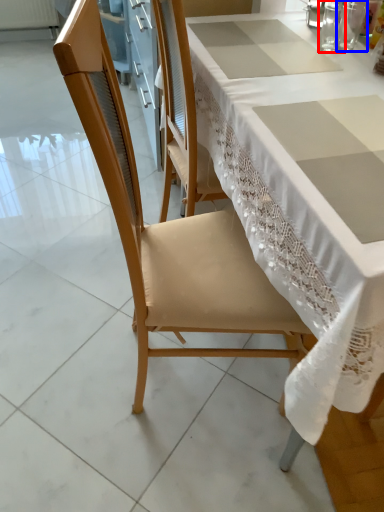
Question: Which object appears closest to the camera in this image, tableware (highlighted by a red box) or tableware (highlighted by a blue box)?

Choices:
 (A) tableware
 (B) tableware

Answer: (A)